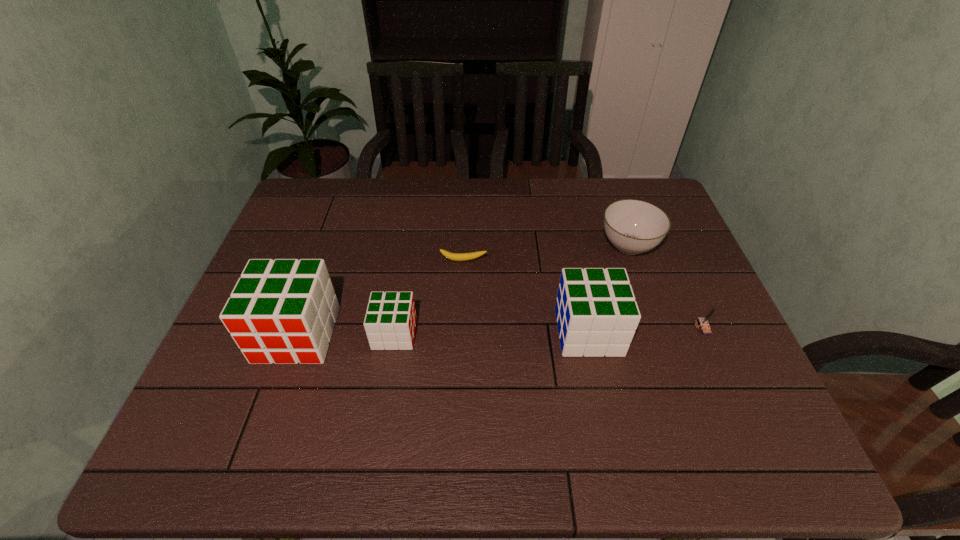
Find the location of `the leftmost cube`. the leftmost cube is located at coordinates (283, 311).

Find the location of `the shortest cube`. the shortest cube is located at coordinates (390, 320).

This screenshot has height=540, width=960. Identify the location of the fifth object from right to left. click(x=390, y=320).

Where is `the fifth shortest object`? The height and width of the screenshot is (540, 960). the fifth shortest object is located at coordinates (597, 315).

What are the coordinates of `the second tallest cube` in the screenshot? It's located at (597, 315).

The image size is (960, 540). What are the coordinates of `the fifth object from left to right` in the screenshot? It's located at (632, 226).

What are the coordinates of `the rightmost object` in the screenshot? It's located at (703, 322).

Image resolution: width=960 pixels, height=540 pixels. Identify the location of the shortest object. (473, 255).

Locate an element on the screen. The width and height of the screenshot is (960, 540). the third object from left to right is located at coordinates (473, 255).

At what (x,y) coordinates should I click in order to perform the action: click on free space located on the red face of the leftmost cube. Please return your answer as a coordinate pair (x, y). The image size is (960, 540). Looking at the image, I should click on (271, 409).